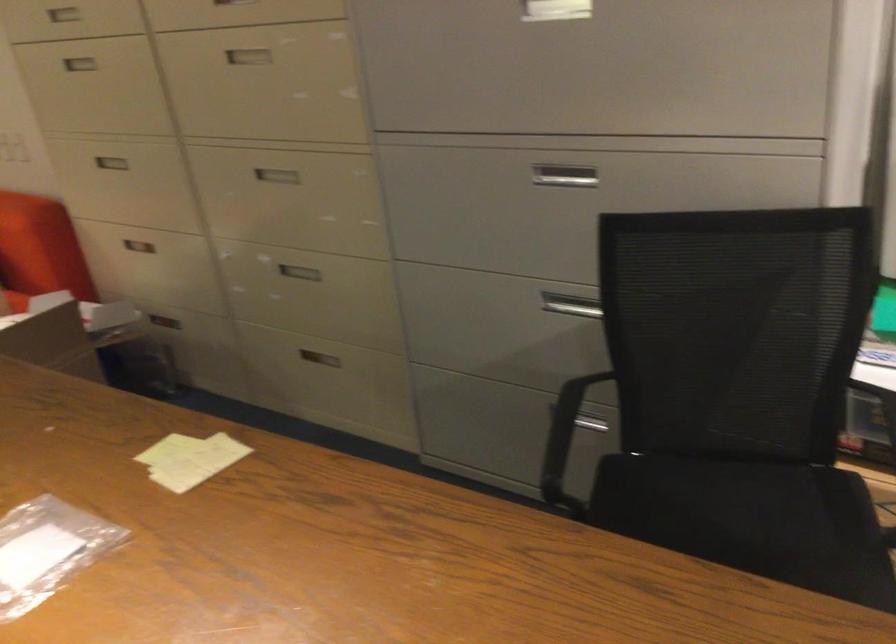
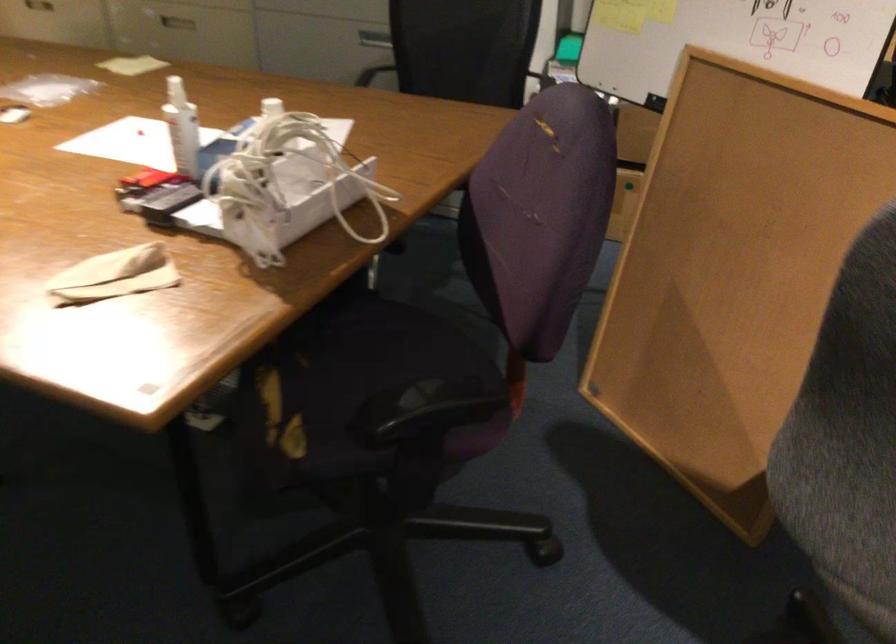
Question: I am providing you with two images of the same scene from different viewpoints. Which of the following objects are not visible in image2?

Choices:
 (A) chair armrest
 (B) black chair armrest
 (C) white plastic bottle
 (D) white Synology box

Answer: (A)